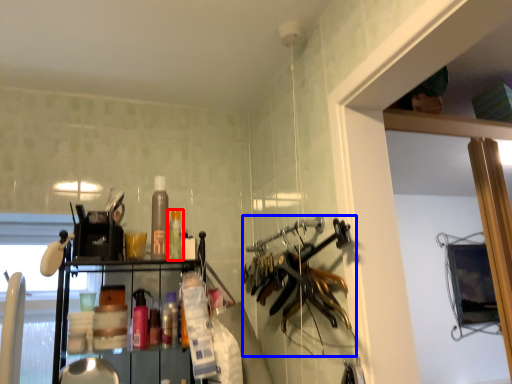
Question: Which object appears closest to the camera in this image, bottle (highlighted by a red box) or hanger (highlighted by a blue box)?

Choices:
 (A) bottle
 (B) hanger

Answer: (B)